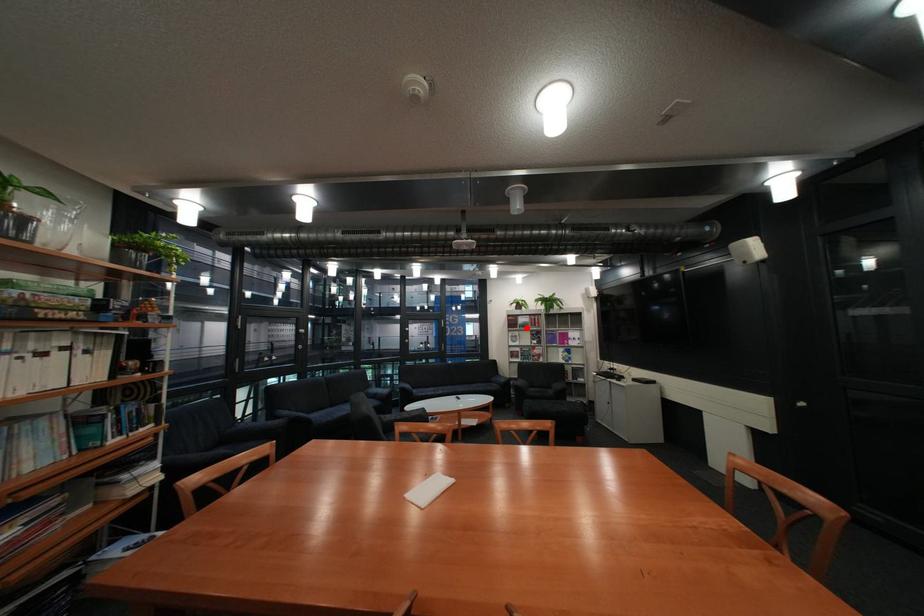
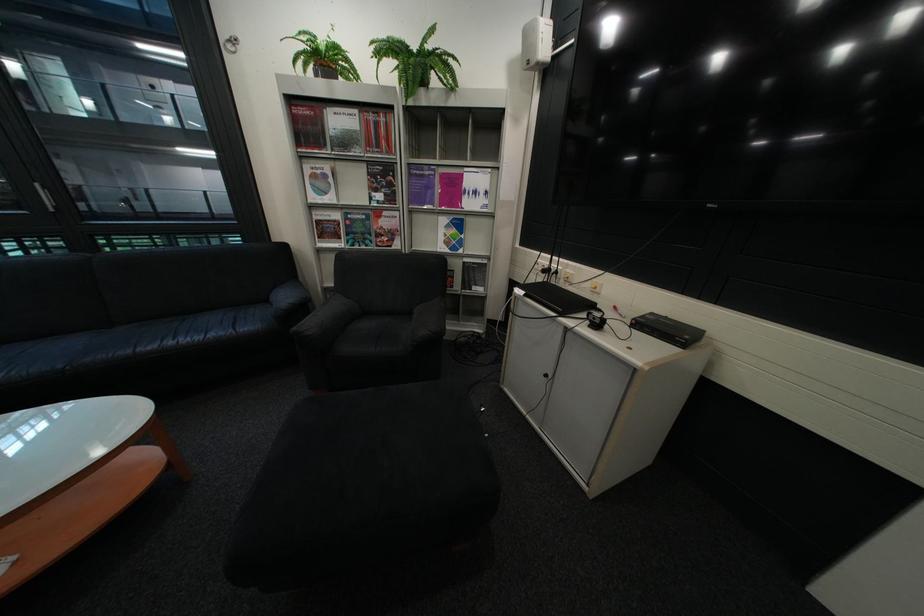
Question: I am providing you with two images of the same scene from different viewpoints. In image1, a red point is highlighted. Considering the same 3D point in image2, which of the following is correct?

Choices:
 (A) It is closer
 (B) It is farther

Answer: (A)